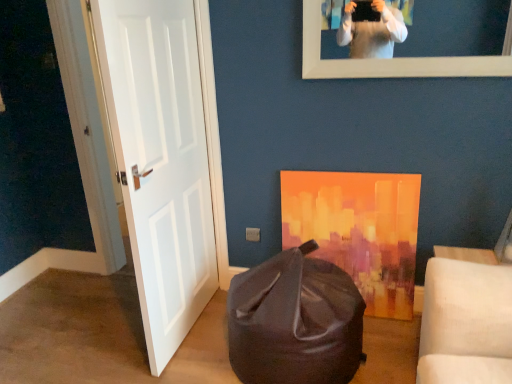
Question: Considering the relative sizes of matte black bean bag at lower center and white matte picture frame at upper center in the image provided, is matte black bean bag at lower center thinner than white matte picture frame at upper center?

Choices:
 (A) yes
 (B) no

Answer: (B)

Question: Considering the relative sizes of matte black bean bag at lower center and white matte picture frame at upper center in the image provided, is matte black bean bag at lower center shorter than white matte picture frame at upper center?

Choices:
 (A) no
 (B) yes

Answer: (A)

Question: Considering the relative sizes of matte black bean bag at lower center and white matte picture frame at upper center in the image provided, is matte black bean bag at lower center smaller than white matte picture frame at upper center?

Choices:
 (A) yes
 (B) no

Answer: (B)

Question: Does matte black bean bag at lower center turn towards white matte picture frame at upper center?

Choices:
 (A) no
 (B) yes

Answer: (A)

Question: Is matte black bean bag at lower center closer to camera compared to white matte picture frame at upper center?

Choices:
 (A) no
 (B) yes

Answer: (B)

Question: Considering the positions of white matte door at left and matte black bean bag at lower center in the image, is white matte door at left bigger or smaller than matte black bean bag at lower center?

Choices:
 (A) small
 (B) big

Answer: (A)

Question: From a real-world perspective, is white matte door at left positioned above or below matte black bean bag at lower center?

Choices:
 (A) above
 (B) below

Answer: (A)

Question: Is point pos(168,92) closer or farther from the camera than point pos(345,314)?

Choices:
 (A) farther
 (B) closer

Answer: (A)

Question: Looking at their shapes, would you say white matte door at left is wider or thinner than matte black bean bag at lower center?

Choices:
 (A) wide
 (B) thin

Answer: (B)

Question: Relative to white matte door at left, is white matte picture frame at upper center in front or behind?

Choices:
 (A) behind
 (B) front

Answer: (A)

Question: Considering the positions of white matte picture frame at upper center and white matte door at left in the image, is white matte picture frame at upper center bigger or smaller than white matte door at left?

Choices:
 (A) small
 (B) big

Answer: (A)

Question: Considering the relative positions of white matte picture frame at upper center and white matte door at left in the image provided, is white matte picture frame at upper center to the left or to the right of white matte door at left?

Choices:
 (A) left
 (B) right

Answer: (B)

Question: Is point (394, 76) positioned closer to the camera than point (194, 142)?

Choices:
 (A) closer
 (B) farther

Answer: (A)

Question: Looking at the image, does matte black bean bag at lower center seem bigger or smaller compared to white matte picture frame at upper center?

Choices:
 (A) big
 (B) small

Answer: (A)

Question: Is point (336, 266) positioned closer to the camera than point (308, 66)?

Choices:
 (A) closer
 (B) farther

Answer: (B)